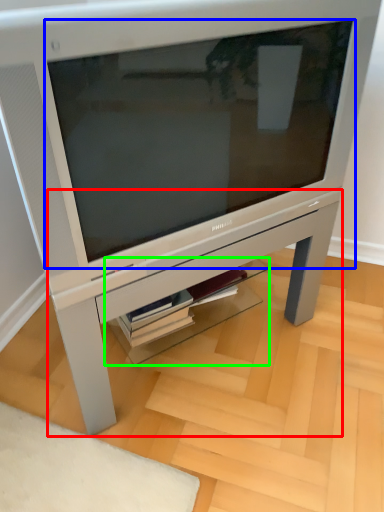
Question: Which object is the closest to the table (highlighted by a red box)? Choose among these: computer monitor (highlighted by a blue box) or shelf (highlighted by a green box).

Choices:
 (A) computer monitor
 (B) shelf

Answer: (B)